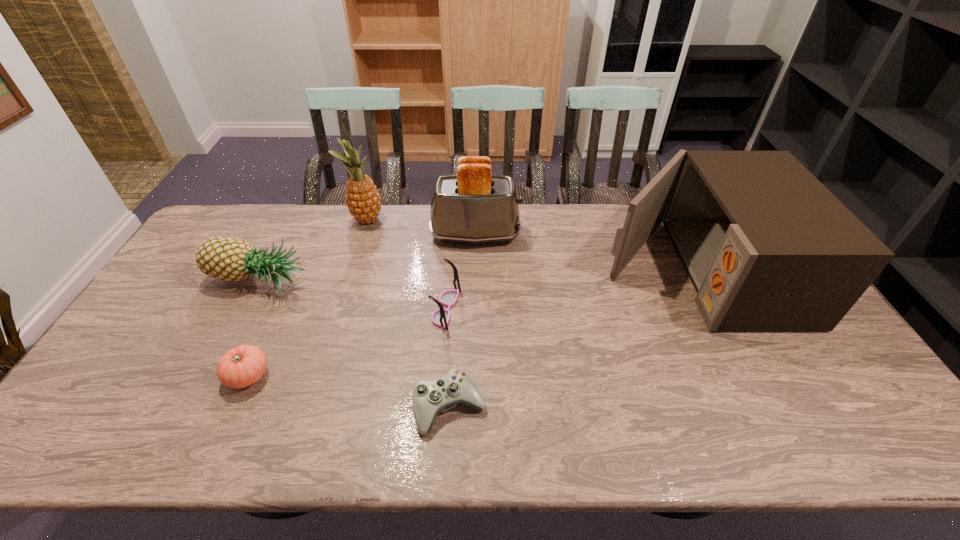
The image size is (960, 540). I want to click on free spot that satisfies the following two spatial constraints: 1. on the side of the toaster with the control lever; 2. on the front side of the control, so click(474, 407).

Find the location of `free spot that satisfies the following two spatial constraints: 1. on the front side of the control; 2. on the right side of the left pineapple`. free spot that satisfies the following two spatial constraints: 1. on the front side of the control; 2. on the right side of the left pineapple is located at coordinates (195, 407).